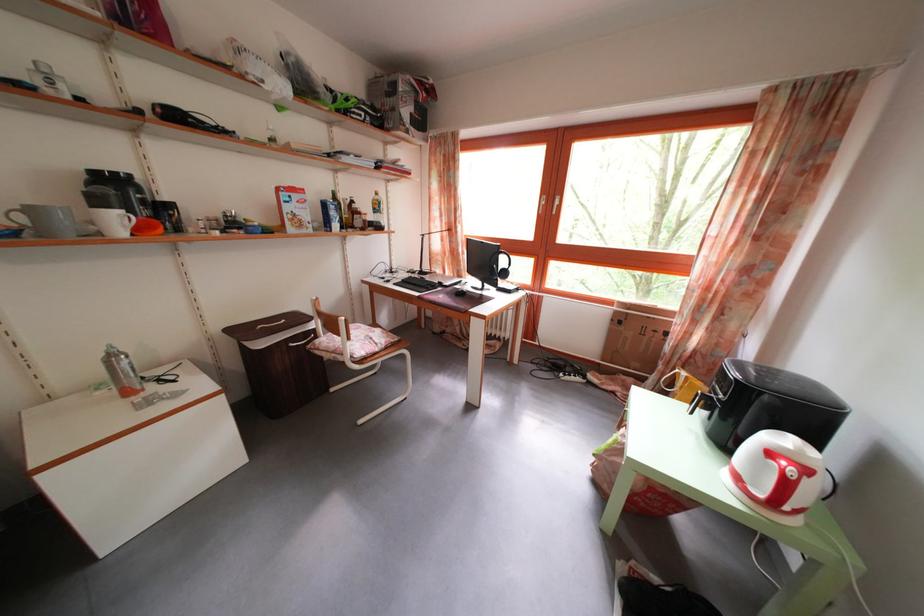
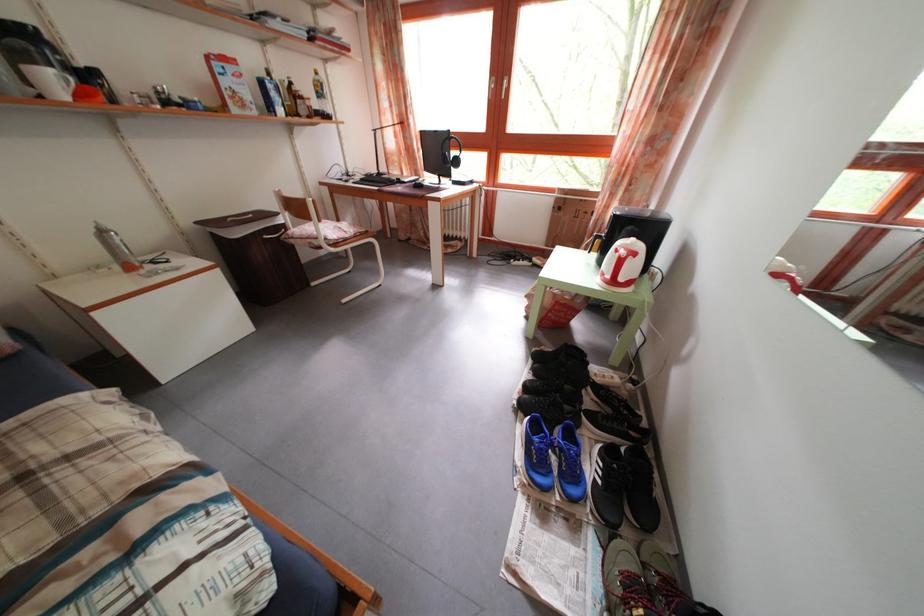
In the second image, find the point that corresponds to (x=118, y=363) in the first image.

(108, 238)